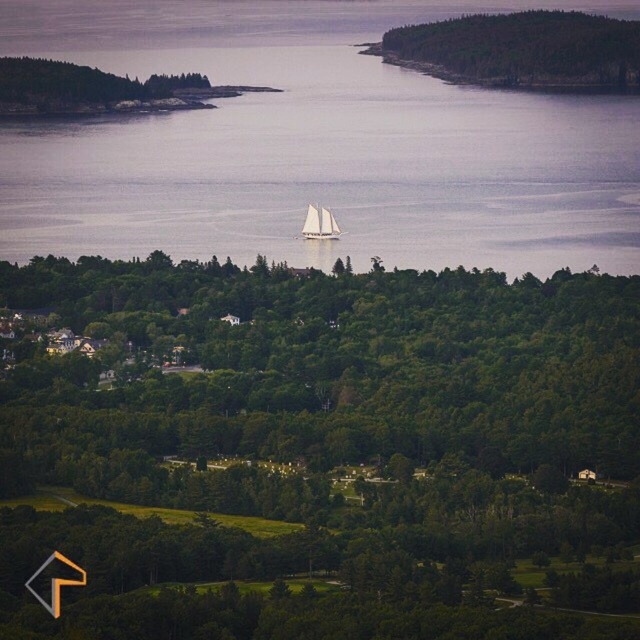
Based on the photo, you are standing at the point with coordinates point (310, 209) and want to walk towards the point with coordinates point (220, 138). Will you be moving towards the foreground or the background of the image?

Since point (220, 138) is behind point (310, 209), moving towards it would mean walking towards the background of the image.

You are a photographer standing in the foreground of this coastal landscape. You want to capture a photo that includes both the green leafy tree at center and the clear water at center. Based on their positions, which object should appear closer to you in the photo?

The green leafy tree at center will appear closer to you in the photo because it is in front of the clear water at center.

You are standing on the shore and want to take a photo of the white sailboat at center and the clear water at center. Which object will appear taller in the photo?

The clear water at center will appear taller in the photo because it has a greater height compared to the white sailboat at center.